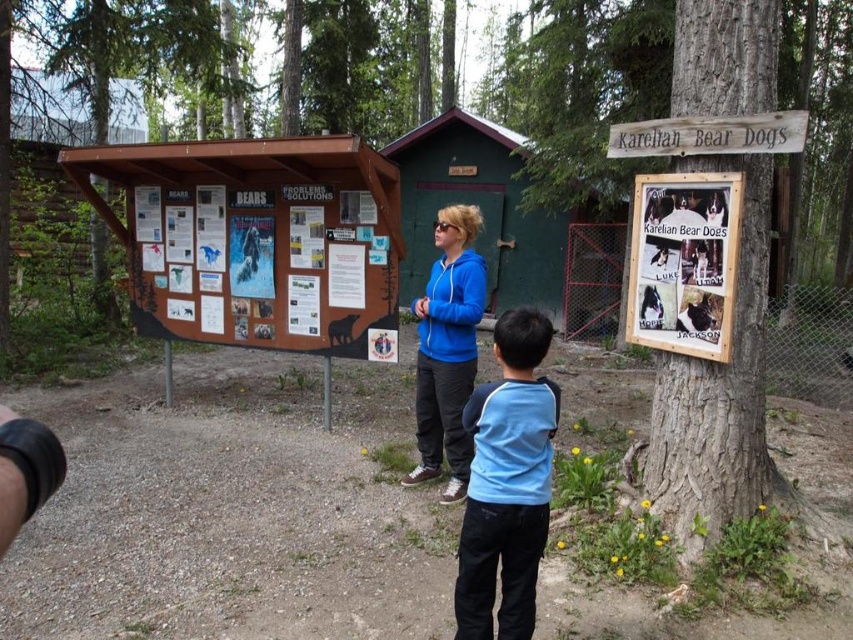
You are a photographer trying to capture both the blue cotton shirt at center and the wooden signboard at upper right in a single shot. Based on their sizes, which object should you focus on first to ensure both are clearly visible in the frame?

The blue cotton shirt at center is larger in size than the wooden signboard at upper right, so you should focus on the blue cotton shirt at center first to ensure both are clearly visible in the frame.